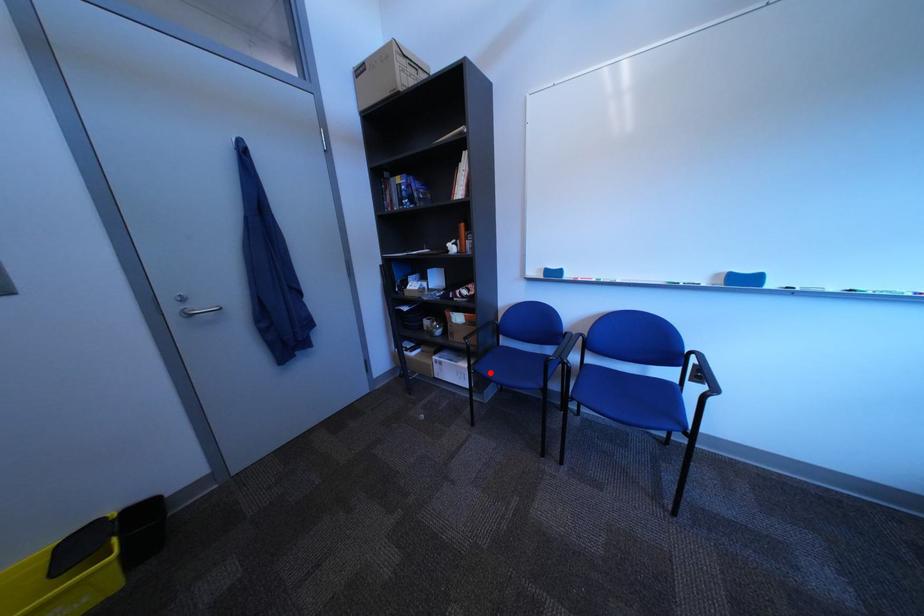
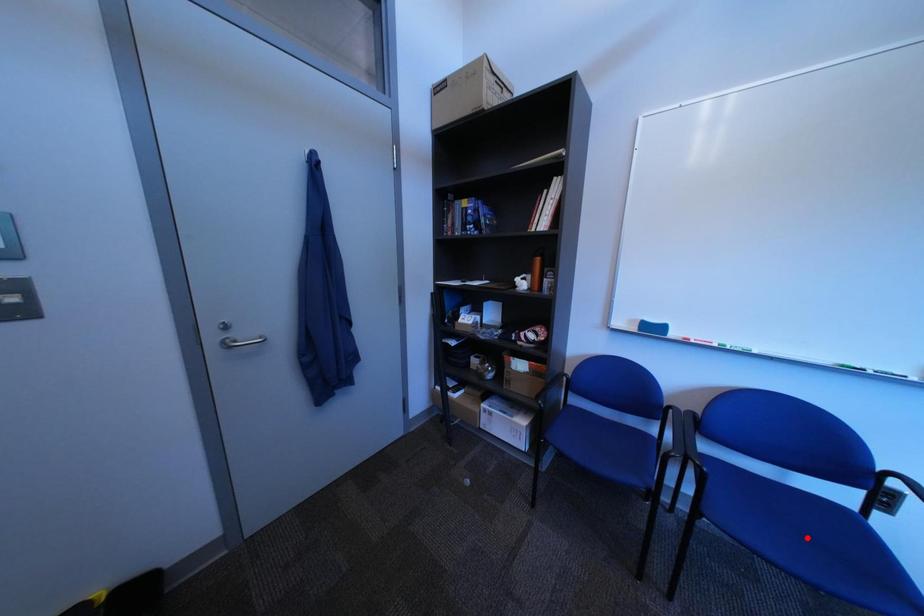
I am providing you with two images of the same scene from different viewpoints. A red point is marked on the first image and another point is marked on the second image. Is the red point in image1 aligned with the point shown in image2?

No